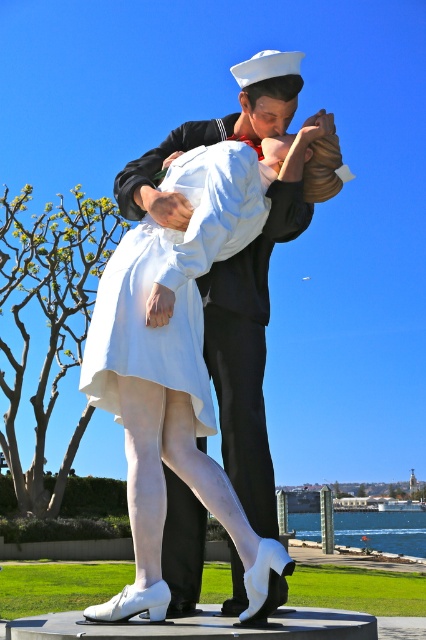
Question: Can you confirm if matte white dress at center is positioned to the right of white satin dress at center?

Choices:
 (A) yes
 (B) no

Answer: (A)

Question: Does matte white dress at center have a smaller size compared to white satin dress at center?

Choices:
 (A) yes
 (B) no

Answer: (B)

Question: Is matte white dress at center below white satin dress at center?

Choices:
 (A) no
 (B) yes

Answer: (B)

Question: Among these objects, which one is farthest from the camera?

Choices:
 (A) white satin dress at center
 (B) matte white dress at center

Answer: (A)